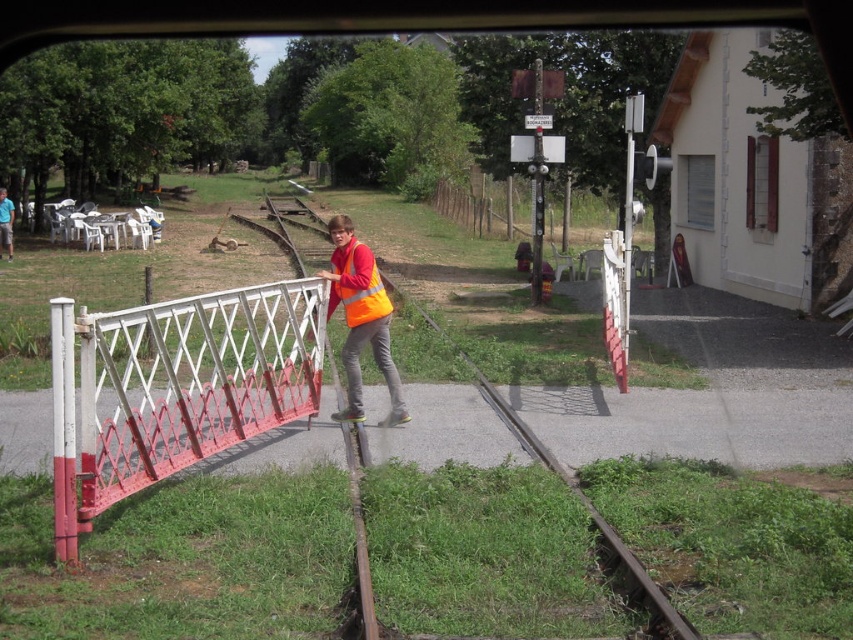
Is orange reflective vest at center to the right of matte orange vest at center from the viewer's perspective?

Yes, orange reflective vest at center is to the right of matte orange vest at center.

Does orange reflective vest at center have a greater height compared to matte orange vest at center?

Yes, orange reflective vest at center is taller than matte orange vest at center.

Where is `orange reflective vest at center`? This screenshot has width=853, height=640. orange reflective vest at center is located at coordinates point(360,317).

Is orange reflective vest at center shorter than wooden fence at center?

Yes, orange reflective vest at center is shorter than wooden fence at center.

Can you confirm if orange reflective vest at center is positioned below wooden fence at center?

Yes, orange reflective vest at center is below wooden fence at center.

The height and width of the screenshot is (640, 853). What do you see at coordinates (360, 317) in the screenshot?
I see `orange reflective vest at center` at bounding box center [360, 317].

Where is `orange reflective vest at center`? This screenshot has height=640, width=853. orange reflective vest at center is located at coordinates (360, 317).

Between metallic white bridge at left and matte orange vest at center, which one has more height?

matte orange vest at center

Is metallic white bridge at left to the left of matte orange vest at center from the viewer's perspective?

Incorrect, metallic white bridge at left is not on the left side of matte orange vest at center.

Between point (308, 337) and point (7, 221), which one is positioned behind?

The point (7, 221) is behind.

I want to click on metallic white bridge at left, so click(x=173, y=387).